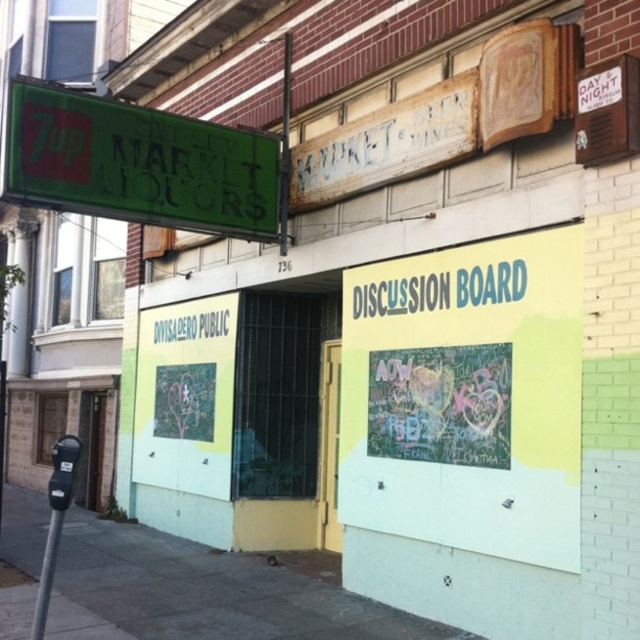
Question: Among these objects, which one is nearest to the camera?

Choices:
 (A) blacktexturedwriting at center
 (B) blue plastic discussion board at center
 (C) metallic gray parking meter at lower left
 (D) green matte signboard at upper left

Answer: (C)

Question: Can you confirm if chalkboard discussion board at center is wider than blacktexturedwriting at center?

Choices:
 (A) yes
 (B) no

Answer: (A)

Question: Estimate the real-world distances between objects in this image. Which object is farther from the metallic gray parking meter at lower left?

Choices:
 (A) blue plastic discussion board at center
 (B) green matte signboard at upper left
 (C) gray concrete sidewalk at lower left

Answer: (A)

Question: Considering the relative positions of gray concrete sidewalk at lower left and metallic gray parking meter at lower left in the image provided, where is gray concrete sidewalk at lower left located with respect to metallic gray parking meter at lower left?

Choices:
 (A) below
 (B) above

Answer: (A)

Question: Is chalkboard discussion board at center wider than gray concrete sidewalk at lower left?

Choices:
 (A) no
 (B) yes

Answer: (B)

Question: Which point appears farthest from the camera in this image?

Choices:
 (A) (147, 576)
 (B) (40, 596)

Answer: (A)